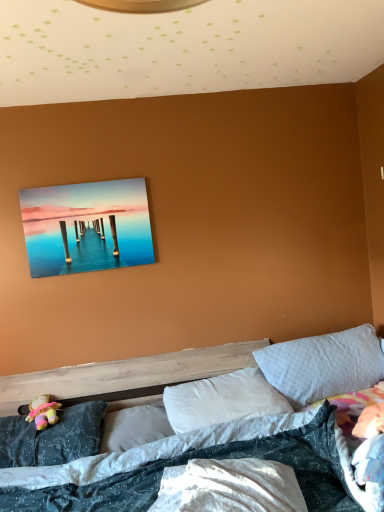
The image size is (384, 512). I want to click on dark blue fabric pillow at lower left, which is counted as the first pillow, starting from the left, so click(x=52, y=437).

This screenshot has width=384, height=512. What do you see at coordinates (323, 365) in the screenshot? I see `white soft pillow at upper right, the 4th pillow viewed from the left` at bounding box center [323, 365].

In order to click on white soft pillow at center, placed as the third pillow when sorted from right to left in this screenshot , I will do `click(134, 426)`.

Is dark blue fabric pillow at lower left, which is counted as the first pillow, starting from the left, positioned with its back to white soft pillow at center, the second pillow in the left-to-right sequence?

No, white soft pillow at center, the second pillow in the left-to-right sequence, is not at the back of dark blue fabric pillow at lower left, which is counted as the first pillow, starting from the left.

Which is correct: dark blue fabric pillow at lower left, which is counted as the first pillow, starting from the left, is inside white soft pillow at center, the second pillow in the left-to-right sequence, or outside of it?

dark blue fabric pillow at lower left, which is counted as the first pillow, starting from the left, is spatially situated outside white soft pillow at center, the second pillow in the left-to-right sequence.

In the image, is dark blue fabric pillow at lower left, which is the fourth pillow in right-to-left order, positioned in front of or behind white soft pillow at center, the second pillow in the left-to-right sequence?

In the image, dark blue fabric pillow at lower left, which is the fourth pillow in right-to-left order, appears in front of white soft pillow at center, the second pillow in the left-to-right sequence.

Which point is more forward, (104, 411) or (138, 413)?

Positioned in front is point (138, 413).

Is white soft pillow at center, the second pillow in the left-to-right sequence, surrounded by white soft pillow at upper right, the 4th pillow viewed from the left?

No, white soft pillow at center, the second pillow in the left-to-right sequence, is located outside of white soft pillow at upper right, the 4th pillow viewed from the left.

Does white soft pillow at upper right, positioned as the 1th pillow in right-to-left order, have a lesser width compared to white soft pillow at center, the second pillow in the left-to-right sequence?

Yes.

Is white soft pillow at upper right, the 4th pillow viewed from the left, to the left or to the right of white soft pillow at center, placed as the third pillow when sorted from right to left, in the image?

From the image, it's evident that white soft pillow at upper right, the 4th pillow viewed from the left, is to the right of white soft pillow at center, placed as the third pillow when sorted from right to left.

Is the surface of white soft pillow at upper right, the 4th pillow viewed from the left, in direct contact with white soft pillow at center, placed as the third pillow when sorted from right to left?

They are not placed beside each other.

Which is in front, point (11, 436) or point (69, 269)?

The point (11, 436) is in front.

Would you say metallic glossy painting at upper center is part of dark blue fabric pillow at lower left, which is the fourth pillow in right-to-left order,'s contents?

No, metallic glossy painting at upper center is located outside of dark blue fabric pillow at lower left, which is the fourth pillow in right-to-left order.

Where is `pillow that is the 3rd one below the metallic glossy painting at upper center (from a real-world perspective)`? This screenshot has height=512, width=384. pillow that is the 3rd one below the metallic glossy painting at upper center (from a real-world perspective) is located at coordinates (52, 437).

Considering the relative positions of white soft pillow at upper right, positioned as the 1th pillow in right-to-left order, and dark blue fabric pillow at lower left, which is the fourth pillow in right-to-left order, in the image provided, is white soft pillow at upper right, positioned as the 1th pillow in right-to-left order, to the right of dark blue fabric pillow at lower left, which is the fourth pillow in right-to-left order, from the viewer's perspective?

Correct, you'll find white soft pillow at upper right, positioned as the 1th pillow in right-to-left order, to the right of dark blue fabric pillow at lower left, which is the fourth pillow in right-to-left order.

From the image's perspective, is white soft pillow at upper right, the 4th pillow viewed from the left, above or below dark blue fabric pillow at lower left, which is counted as the first pillow, starting from the left?

Based on their image positions, white soft pillow at upper right, the 4th pillow viewed from the left, is located above dark blue fabric pillow at lower left, which is counted as the first pillow, starting from the left.

Considering the positions of objects white soft pillow at upper right, the 4th pillow viewed from the left, and dark blue fabric pillow at lower left, which is the fourth pillow in right-to-left order, in the image provided, who is behind, white soft pillow at upper right, the 4th pillow viewed from the left, or dark blue fabric pillow at lower left, which is the fourth pillow in right-to-left order,?

white soft pillow at upper right, the 4th pillow viewed from the left, is further from the camera.

Is white soft pillow at upper right, positioned as the 1th pillow in right-to-left order, inside the boundaries of dark blue fabric pillow at lower left, which is counted as the first pillow, starting from the left, or outside?

white soft pillow at upper right, positioned as the 1th pillow in right-to-left order, is not enclosed by dark blue fabric pillow at lower left, which is counted as the first pillow, starting from the left.

From the metallic glossy painting at upper center, count 2nd pillow to the right and point to it. Please provide its 2D coordinates.

[(222, 400)]

Measure the distance between white soft pillow at center, arranged as the 3th pillow when viewed from the left, and metallic glossy painting at upper center.

white soft pillow at center, arranged as the 3th pillow when viewed from the left, and metallic glossy painting at upper center are 38.56 inches apart.

Is point (172, 398) farther from viewer compared to point (90, 246)?

No, it is not.

From the image's perspective, between white soft pillow at center, acting as the second pillow starting from the right, and metallic glossy painting at upper center, which one is located above?

metallic glossy painting at upper center is shown above in the image.

Locate an element on the screen. The width and height of the screenshot is (384, 512). picture frame located above the white soft pillow at upper right, positioned as the 1th pillow in right-to-left order (from the image's perspective) is located at coordinates (x=86, y=227).

Between metallic glossy painting at upper center and white soft pillow at upper right, the 4th pillow viewed from the left, which one has larger size?

white soft pillow at upper right, the 4th pillow viewed from the left.

How many degrees apart are the facing directions of metallic glossy painting at upper center and white soft pillow at upper right, the 4th pillow viewed from the left?

The angle between the facing direction of metallic glossy painting at upper center and the facing direction of white soft pillow at upper right, the 4th pillow viewed from the left, is 0.545 degrees.

Is metallic glossy painting at upper center beside white soft pillow at upper right, positioned as the 1th pillow in right-to-left order?

They are not placed beside each other.

Does white soft pillow at center, arranged as the 3th pillow when viewed from the left, lie in front of white soft pillow at center, the second pillow in the left-to-right sequence?

No, white soft pillow at center, arranged as the 3th pillow when viewed from the left, is further to the viewer.

Is white soft pillow at center, arranged as the 3th pillow when viewed from the left, facing away from white soft pillow at center, placed as the third pillow when sorted from right to left?

No.

From a real-world perspective, is white soft pillow at center, arranged as the 3th pillow when viewed from the left, positioned under white soft pillow at center, the second pillow in the left-to-right sequence, based on gravity?

No.

Is white soft pillow at center, acting as the second pillow starting from the right, to the left of white soft pillow at center, the second pillow in the left-to-right sequence, from the viewer's perspective?

In fact, white soft pillow at center, acting as the second pillow starting from the right, is to the right of white soft pillow at center, the second pillow in the left-to-right sequence.

Locate an element on the screen. the 1st pillow counting from the right side of the dark blue fabric pillow at lower left, which is the fourth pillow in right-to-left order is located at coordinates (134, 426).

From a real-world perspective, starting from the white soft pillow at upper right, the 4th pillow viewed from the left, which pillow is the 3rd one below it? Please provide its 2D coordinates.

[(134, 426)]

Based on their spatial positions, is dark blue fabric pillow at lower left, which is the fourth pillow in right-to-left order, or white soft pillow at center, acting as the second pillow starting from the right, closer to white soft pillow at center, placed as the third pillow when sorted from right to left?

dark blue fabric pillow at lower left, which is the fourth pillow in right-to-left order.

Estimate the real-world distances between objects in this image. Which object is closer to dark blue fabric pillow at lower left, which is the fourth pillow in right-to-left order, white soft pillow at center, acting as the second pillow starting from the right, or metallic glossy painting at upper center?

Based on the image, white soft pillow at center, acting as the second pillow starting from the right, appears to be nearer to dark blue fabric pillow at lower left, which is the fourth pillow in right-to-left order.

Based on their spatial positions, is dark blue fabric pillow at lower left, which is the fourth pillow in right-to-left order, or white soft pillow at center, placed as the third pillow when sorted from right to left, further from white soft pillow at center, acting as the second pillow starting from the right?

dark blue fabric pillow at lower left, which is the fourth pillow in right-to-left order, is positioned further to the anchor white soft pillow at center, acting as the second pillow starting from the right.

Based on their spatial positions, is dark blue fabric pillow at lower left, which is the fourth pillow in right-to-left order, or white soft pillow at center, arranged as the 3th pillow when viewed from the left, closer to white soft pillow at upper right, positioned as the 1th pillow in right-to-left order?

The object closer to white soft pillow at upper right, positioned as the 1th pillow in right-to-left order, is white soft pillow at center, arranged as the 3th pillow when viewed from the left.

Consider the image. From the image, which object appears to be farther from white soft pillow at center, placed as the third pillow when sorted from right to left, white soft pillow at center, acting as the second pillow starting from the right, or metallic glossy painting at upper center?

Among the two, metallic glossy painting at upper center is located further to white soft pillow at center, placed as the third pillow when sorted from right to left.

When comparing their distances from white soft pillow at center, the second pillow in the left-to-right sequence, does metallic glossy painting at upper center or white soft pillow at center, arranged as the 3th pillow when viewed from the left, seem closer?

white soft pillow at center, arranged as the 3th pillow when viewed from the left.

Which object lies further to the anchor point white soft pillow at center, acting as the second pillow starting from the right, white soft pillow at center, placed as the third pillow when sorted from right to left, or metallic glossy painting at upper center?

Based on the image, metallic glossy painting at upper center appears to be further to white soft pillow at center, acting as the second pillow starting from the right.

Looking at this image, based on their spatial positions, is white soft pillow at center, acting as the second pillow starting from the right, or white soft pillow at upper right, the 4th pillow viewed from the left, closer to dark blue fabric pillow at lower left, which is the fourth pillow in right-to-left order?

white soft pillow at center, acting as the second pillow starting from the right, is closer to dark blue fabric pillow at lower left, which is the fourth pillow in right-to-left order.

Locate an element on the screen. pillow located between dark blue fabric pillow at lower left, which is counted as the first pillow, starting from the left, and white soft pillow at center, arranged as the 3th pillow when viewed from the left, in the left-right direction is located at coordinates (134, 426).

The width and height of the screenshot is (384, 512). Find the location of `picture frame between dark blue fabric pillow at lower left, which is the fourth pillow in right-to-left order, and white soft pillow at upper right, the 4th pillow viewed from the left, in the horizontal direction`. picture frame between dark blue fabric pillow at lower left, which is the fourth pillow in right-to-left order, and white soft pillow at upper right, the 4th pillow viewed from the left, in the horizontal direction is located at coordinates (86, 227).

I want to click on pillow located between white soft pillow at center, placed as the third pillow when sorted from right to left, and white soft pillow at upper right, the 4th pillow viewed from the left, in the left-right direction, so click(222, 400).